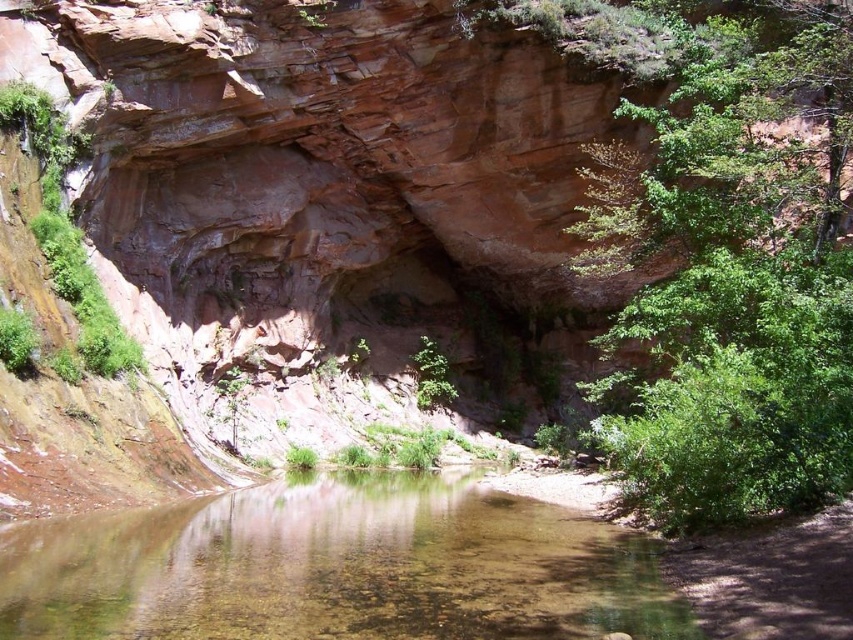
Can you confirm if green leafy tree at right is smaller than clear water at center?

No.

Does green leafy tree at right appear on the right side of clear water at center?

Yes, green leafy tree at right is to the right of clear water at center.

The width and height of the screenshot is (853, 640). I want to click on green leafy tree at right, so click(735, 268).